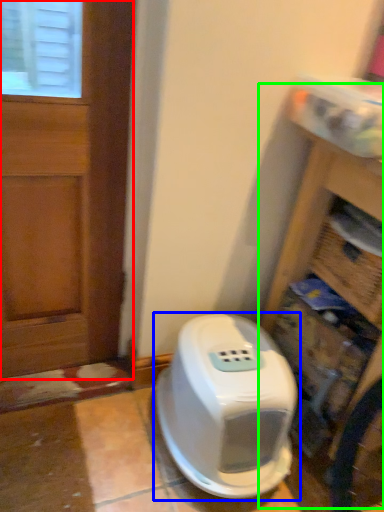
Question: Estimate the real-world distances between objects in this image. Which object is farther from door (highlighted by a red box), home appliance (highlighted by a blue box) or bookshelf (highlighted by a green box)?

Choices:
 (A) home appliance
 (B) bookshelf

Answer: (B)